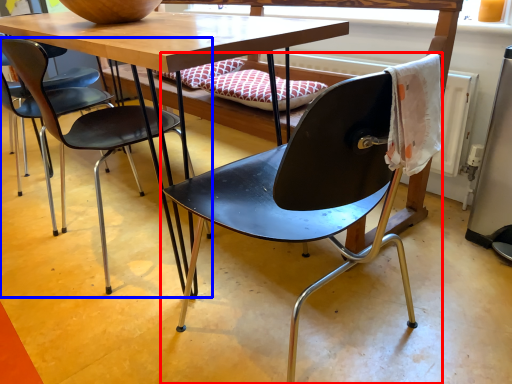
Question: Among these objects, which one is farthest to the camera, chair (highlighted by a red box) or chair (highlighted by a blue box)?

Choices:
 (A) chair
 (B) chair

Answer: (B)